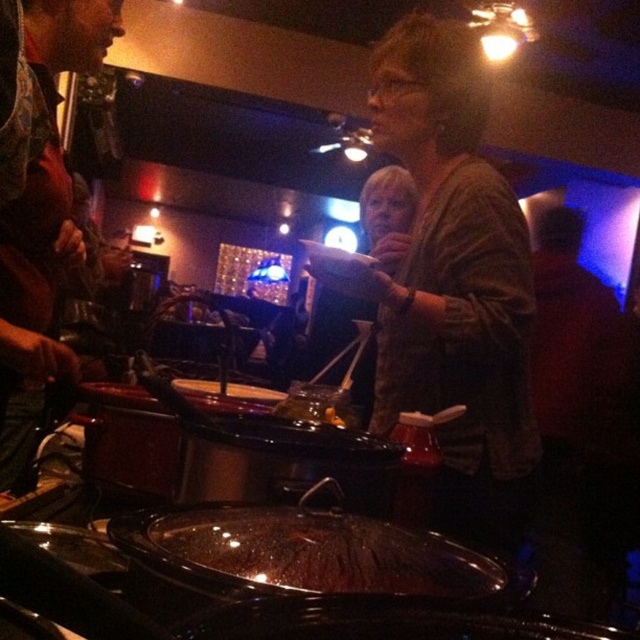
Does brown textured sweater at upper right appear on the right side of translucent glass plate at center?

Yes, brown textured sweater at upper right is to the right of translucent glass plate at center.

Who is more distant from viewer, (392, 419) or (211, 385)?

The point (211, 385) is behind.

What do you see at coordinates (452, 282) in the screenshot? I see `brown textured sweater at upper right` at bounding box center [452, 282].

Where is `brown textured sweater at upper right`? This screenshot has width=640, height=640. brown textured sweater at upper right is located at coordinates (452, 282).